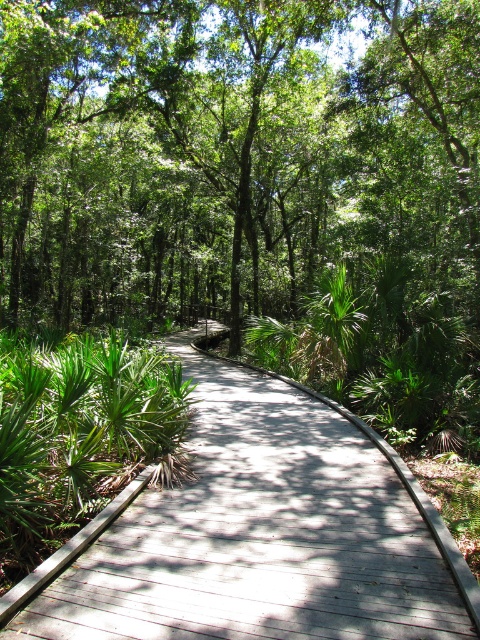
Question: Does green leafy tree at center have a smaller size compared to wooden boardwalk at center?

Choices:
 (A) yes
 (B) no

Answer: (B)

Question: Which point is closer to the camera?

Choices:
 (A) wooden boardwalk at center
 (B) green leafy tree at center

Answer: (A)

Question: Can you confirm if green leafy tree at center is smaller than wooden boardwalk at center?

Choices:
 (A) no
 (B) yes

Answer: (A)

Question: Does green leafy tree at center have a lesser width compared to wooden boardwalk at center?

Choices:
 (A) yes
 (B) no

Answer: (B)

Question: Which point is closer to the camera?

Choices:
 (A) (156, 90)
 (B) (131, 504)

Answer: (B)

Question: Which point is closer to the camera taking this photo?

Choices:
 (A) (343, 593)
 (B) (171, 166)

Answer: (A)